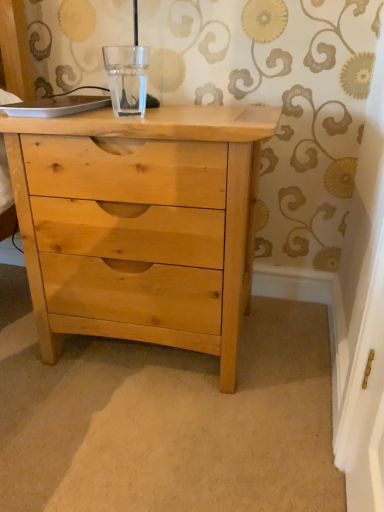
Question: Considering the relative sizes of natural wood chest of drawers at center and transparent glass at center in the image provided, is natural wood chest of drawers at center smaller than transparent glass at center?

Choices:
 (A) no
 (B) yes

Answer: (A)

Question: Considering the relative positions of natural wood chest of drawers at center and transparent glass at center in the image provided, is natural wood chest of drawers at center to the left of transparent glass at center from the viewer's perspective?

Choices:
 (A) no
 (B) yes

Answer: (A)

Question: Is the position of natural wood chest of drawers at center less distant than that of transparent glass at center?

Choices:
 (A) yes
 (B) no

Answer: (A)

Question: From the image's perspective, is natural wood chest of drawers at center located beneath transparent glass at center?

Choices:
 (A) yes
 (B) no

Answer: (A)

Question: From the image's perspective, is natural wood chest of drawers at center located above transparent glass at center?

Choices:
 (A) no
 (B) yes

Answer: (A)

Question: From a real-world perspective, is natural wood chest of drawers at center over transparent glass at center?

Choices:
 (A) yes
 (B) no

Answer: (B)

Question: Does transparent glass at center turn towards natural wood chest of drawers at center?

Choices:
 (A) yes
 (B) no

Answer: (B)

Question: Is transparent glass at center positioned with its back to natural wood chest of drawers at center?

Choices:
 (A) yes
 (B) no

Answer: (B)

Question: Considering the relative sizes of transparent glass at center and natural wood chest of drawers at center in the image provided, is transparent glass at center bigger than natural wood chest of drawers at center?

Choices:
 (A) no
 (B) yes

Answer: (A)

Question: From the image's perspective, does transparent glass at center appear lower than natural wood chest of drawers at center?

Choices:
 (A) yes
 (B) no

Answer: (B)

Question: Does transparent glass at center have a lesser height compared to natural wood chest of drawers at center?

Choices:
 (A) yes
 (B) no

Answer: (A)

Question: Is transparent glass at center at the right side of natural wood chest of drawers at center?

Choices:
 (A) yes
 (B) no

Answer: (B)

Question: In the image, is transparent glass at center on the left side or the right side of natural wood chest of drawers at center?

Choices:
 (A) left
 (B) right

Answer: (A)